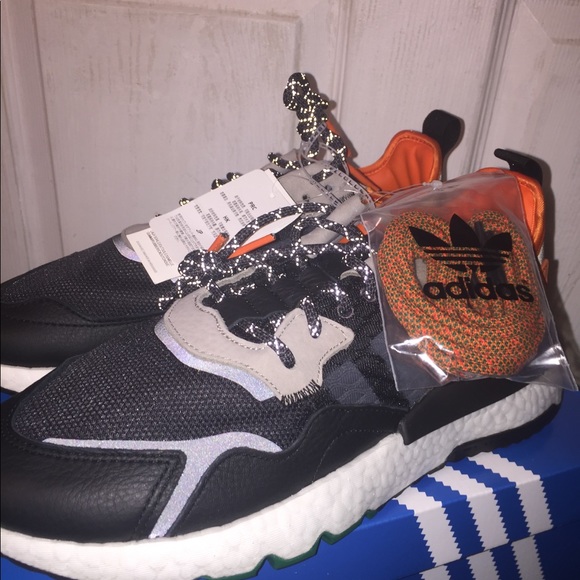
Where is `top of shoebox`? The height and width of the screenshot is (580, 580). top of shoebox is located at coordinates (474, 514).